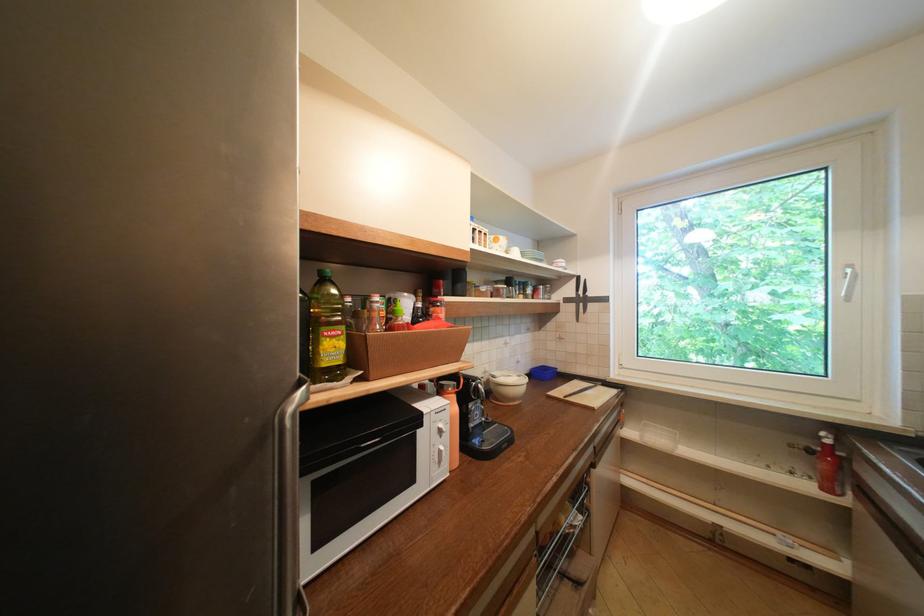
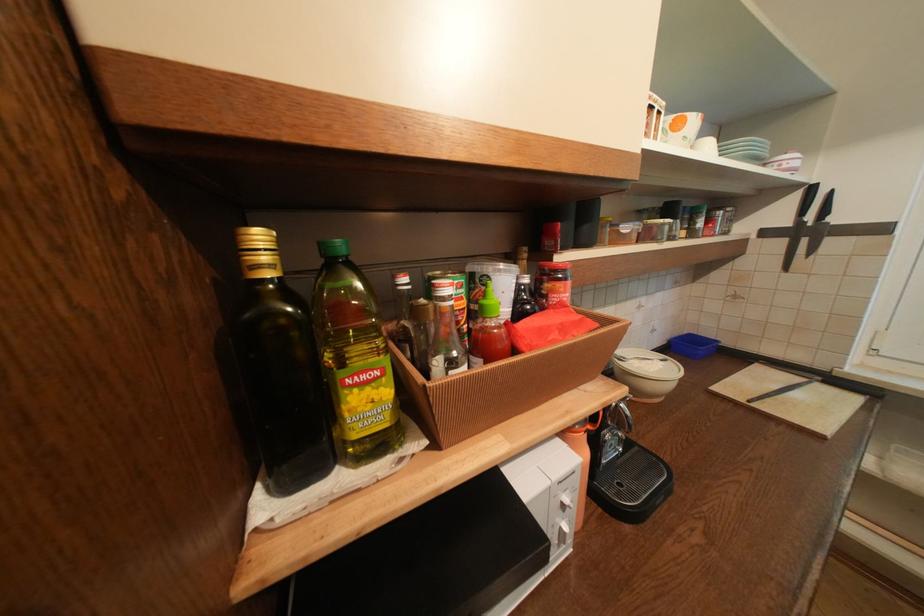
Locate, in the second image, the point that corresponds to the point at 582,282 in the first image.

(807, 196)